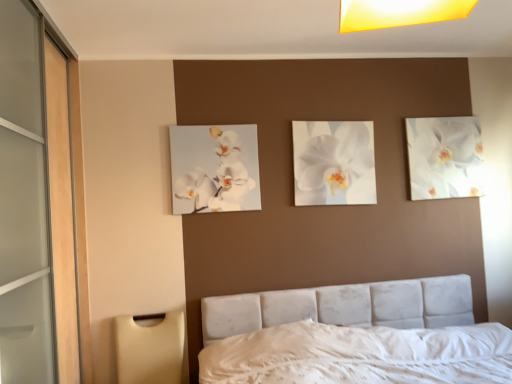
Question: From a real-world perspective, is velvet white bed at center positioned over white glossy orchid at upper left, which appears as the first flower when viewed from the front, based on gravity?

Choices:
 (A) no
 (B) yes

Answer: (A)

Question: Is velvet white bed at center closer to the viewer compared to white glossy orchid at upper left, arranged as the 3th flower when viewed from the right?

Choices:
 (A) yes
 (B) no

Answer: (A)

Question: Does velvet white bed at center have a larger size compared to white glossy orchid at upper left, which appears as the first flower when viewed from the front?

Choices:
 (A) no
 (B) yes

Answer: (B)

Question: Is velvet white bed at center located outside white glossy orchid at upper left, arranged as the 3th flower when viewed from the right?

Choices:
 (A) no
 (B) yes

Answer: (B)

Question: Is velvet white bed at center far away from white glossy orchid at upper left, the 1th flower viewed from the left?

Choices:
 (A) no
 (B) yes

Answer: (A)

Question: Is white glossy orchid at upper left, the 1th flower viewed from the left, surrounded by velvet white bed at center?

Choices:
 (A) no
 (B) yes

Answer: (A)

Question: Does velvet white bed at center appear on the left side of beige plastic lampshade at lower left?

Choices:
 (A) yes
 (B) no

Answer: (B)

Question: Is velvet white bed at center bigger than beige plastic lampshade at lower left?

Choices:
 (A) no
 (B) yes

Answer: (B)

Question: Is velvet white bed at center facing away from beige plastic lampshade at lower left?

Choices:
 (A) no
 (B) yes

Answer: (A)

Question: From the image's perspective, is velvet white bed at center on beige plastic lampshade at lower left?

Choices:
 (A) yes
 (B) no

Answer: (A)

Question: Is velvet white bed at center beside beige plastic lampshade at lower left?

Choices:
 (A) no
 (B) yes

Answer: (A)

Question: From a real-world perspective, is velvet white bed at center positioned under beige plastic lampshade at lower left based on gravity?

Choices:
 (A) yes
 (B) no

Answer: (A)

Question: Is white glossy orchid at upper right, the 1th flower in the back-to-front sequence, positioned with its back to velvet white bed at center?

Choices:
 (A) yes
 (B) no

Answer: (B)